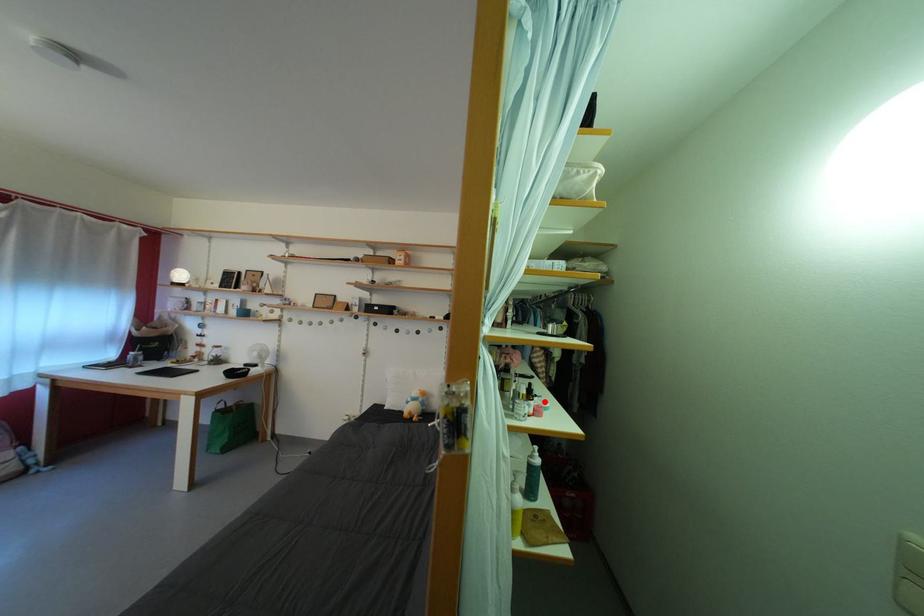
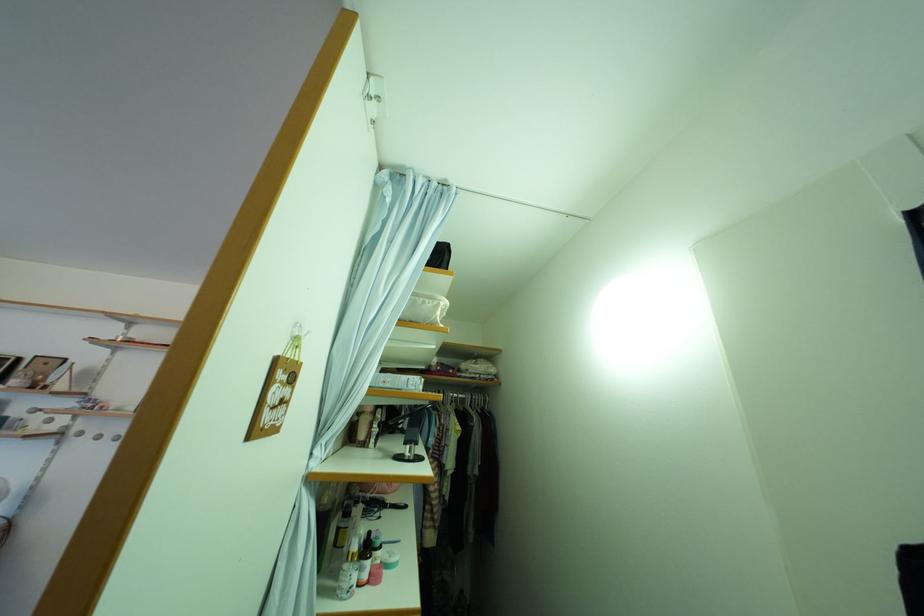
Question: I am providing you with two images of the same scene from different viewpoints. A red point is marked on the first image. Is the red point's position out of view in image 2?

Choices:
 (A) Yes
 (B) No

Answer: (B)